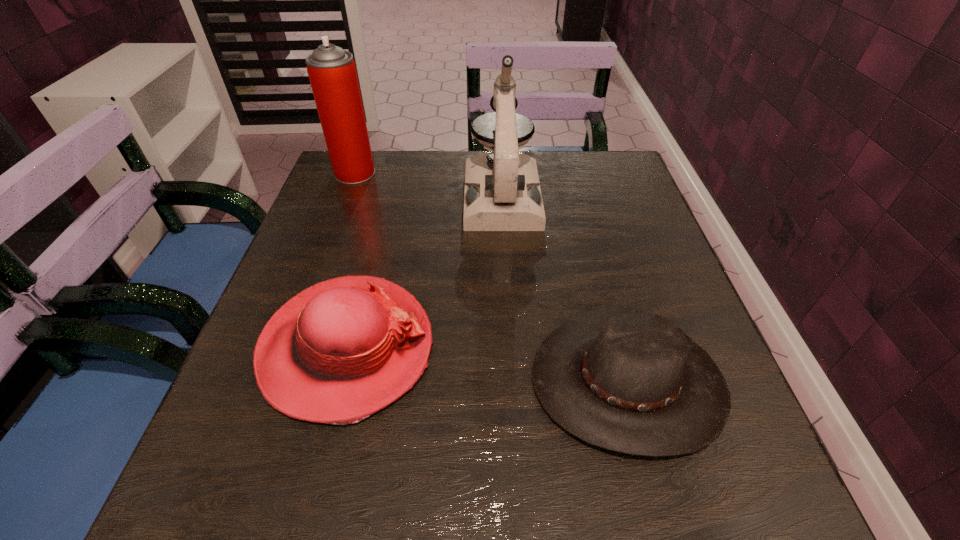
Where is `the third closest object to the aerosol can`? This screenshot has width=960, height=540. the third closest object to the aerosol can is located at coordinates (625, 380).

Identify the location of object that is the third closest one to the microscope. (625, 380).

At what (x,y) coordinates should I click in order to perform the action: click on free space that satisfies the following two spatial constraints: 1. at the eyepiece of the microscope; 2. at the front of the left hat with a bow. Please return your answer as a coordinate pair (x, y). Looking at the image, I should click on (512, 348).

Find the location of a particular element. The image size is (960, 540). vacant space that satisfies the following two spatial constraints: 1. at the eyepiece of the microscope; 2. at the front of the left hat with a bow is located at coordinates (512, 348).

You are a GUI agent. You are given a task and a screenshot of the screen. Output one action in this format:
    pyautogui.click(x=<x>, y=<y>)
    Task: Click on the vacant space that satisfies the following two spatial constraints: 1. at the eyepiece of the microscope; 2. at the front of the left hat with a bow
    
    Given the screenshot: What is the action you would take?
    pyautogui.click(x=512, y=348)

The width and height of the screenshot is (960, 540). I want to click on free space that satisfies the following two spatial constraints: 1. at the eyepiece of the microscope; 2. at the front of the left hat with a bow, so click(x=512, y=348).